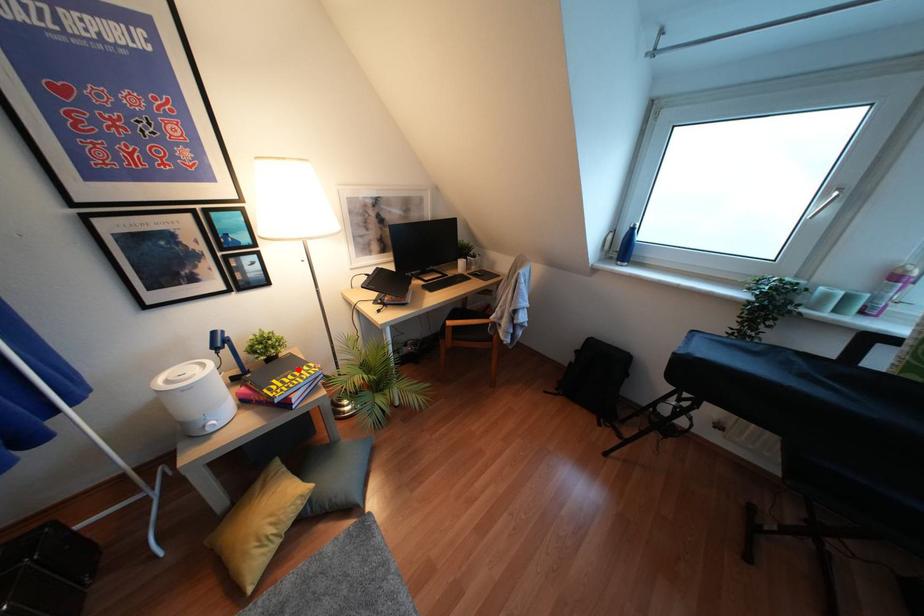
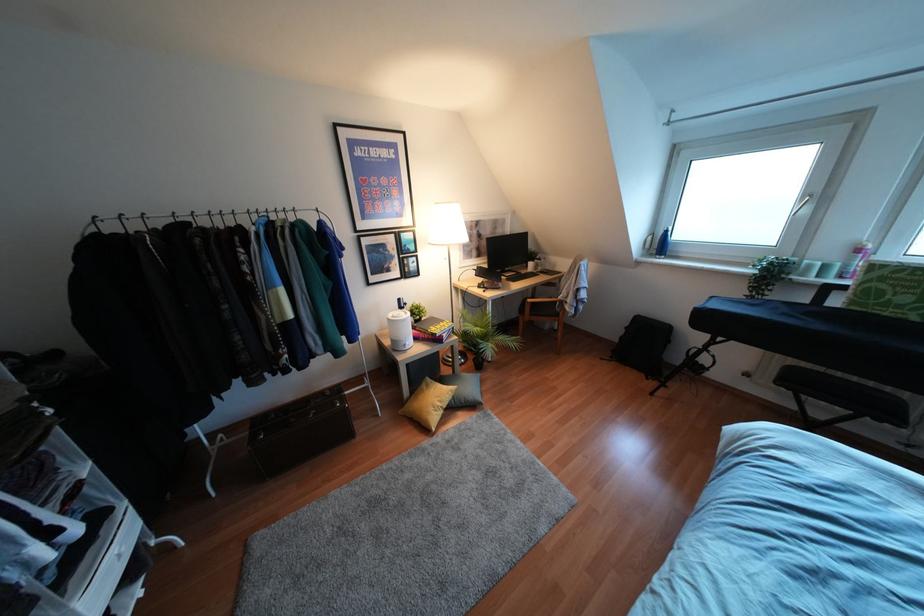
Question: I am providing you with two images of the same scene from different viewpoints. Image1 has a red point marked. In image2, the corresponding 3D location appears at what relative position? Reply with the corresponding letter.

Choices:
 (A) Closer
 (B) Farther

Answer: (B)